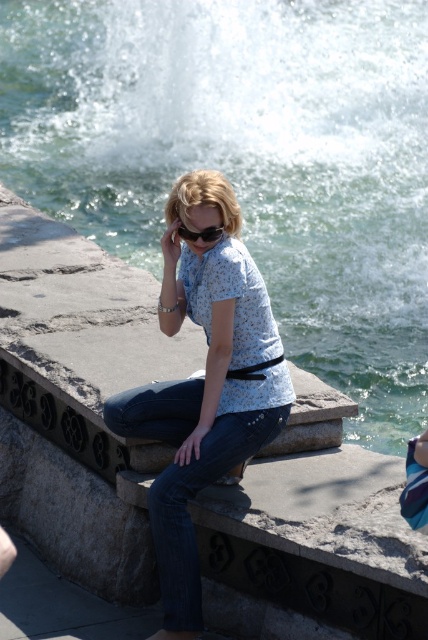
Question: Does clear water at center appear under black matte goggles at center?

Choices:
 (A) yes
 (B) no

Answer: (B)

Question: Is clear water at center bigger than denim at center?

Choices:
 (A) no
 (B) yes

Answer: (B)

Question: Based on their relative distances, which object is farther from the denim at center?

Choices:
 (A) clear water at center
 (B) black matte goggles at center

Answer: (A)

Question: Is denim at center behind black matte goggles at center?

Choices:
 (A) no
 (B) yes

Answer: (A)

Question: Which object is farther from the camera taking this photo?

Choices:
 (A) black matte goggles at center
 (B) clear water at center

Answer: (B)

Question: Which of the following is the closest to the observer?

Choices:
 (A) denim at center
 (B) clear water at center

Answer: (A)